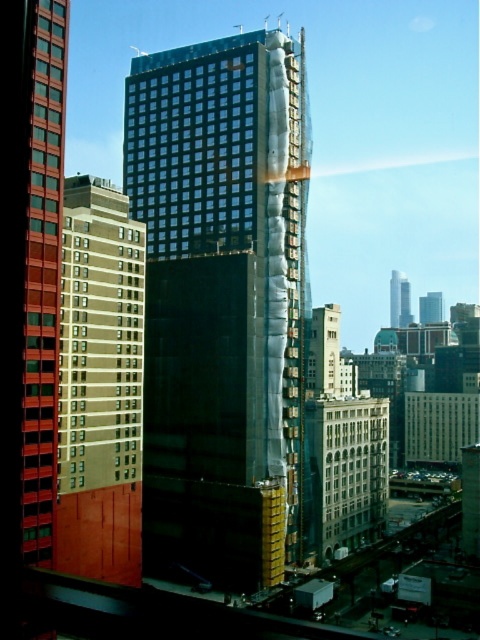
Question: Does dark glass windows at center come in front of metallic silver building at center?

Choices:
 (A) no
 (B) yes

Answer: (B)

Question: Does black glass building at center come behind beige glass windows at left?

Choices:
 (A) yes
 (B) no

Answer: (A)

Question: Which point is closer to the camera?

Choices:
 (A) white textured wall at center
 (B) beige glass windows at left

Answer: (B)

Question: Based on their relative distances, which object is farther from the beige glass windows at left?

Choices:
 (A) smooth glass skyscraper at center
 (B) metallic silver building at center

Answer: (A)

Question: Which of the following is the farthest from the observer?

Choices:
 (A) metallic silver building at center
 (B) white textured wall at center
 (C) dark glass windows at center
 (D) smooth glass skyscraper at center

Answer: (D)

Question: Can you confirm if beige glass windows at left is wider than matte red glass windows at left?

Choices:
 (A) no
 (B) yes

Answer: (A)